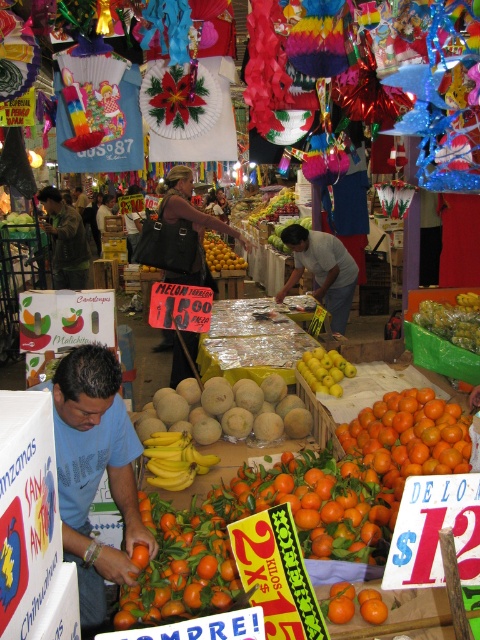
Measure the distance between point (460, 305) and camera.

Point (460, 305) and camera are 4.23 meters apart.

The image size is (480, 640). What do you see at coordinates (453, 320) in the screenshot?
I see `green matte melon at center` at bounding box center [453, 320].

The height and width of the screenshot is (640, 480). What are the coordinates of `green matte melon at center` in the screenshot? It's located at (453, 320).

Find the location of a particular element. This screenshot has width=480, height=640. green matte melon at center is located at coordinates (453, 320).

Which is below, blue t-shirt at lower left or white cotton shirt at center?

blue t-shirt at lower left

Which of these two, blue t-shirt at lower left or white cotton shirt at center, stands taller?

blue t-shirt at lower left is taller.

Between point (75, 420) and point (334, 244), which one is positioned in front?

Positioned in front is point (75, 420).

Where is `blue t-shirt at lower left`? This screenshot has height=640, width=480. blue t-shirt at lower left is located at coordinates (95, 472).

Between smooth yellow melon at center and orange matte tomato at center, which one is positioned lower?

orange matte tomato at center is below.

Does smooth yellow melon at center have a smaller size compared to orange matte tomato at center?

Incorrect, smooth yellow melon at center is not smaller in size than orange matte tomato at center.

The height and width of the screenshot is (640, 480). I want to click on smooth yellow melon at center, so tap(220, 253).

What are the coordinates of `smooth yellow melon at center` in the screenshot? It's located at (220, 253).